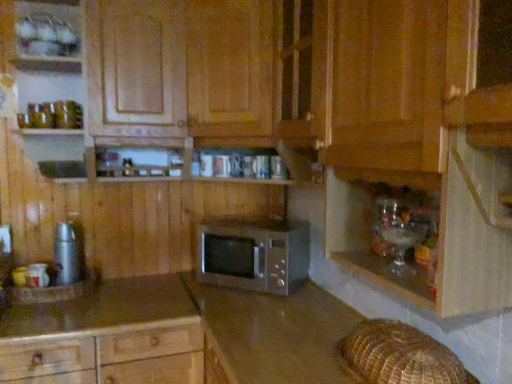
The width and height of the screenshot is (512, 384). What are the coordinates of `free area in between satin silver microwave at center and metallic silver thermos at left` in the screenshot? It's located at (163, 291).